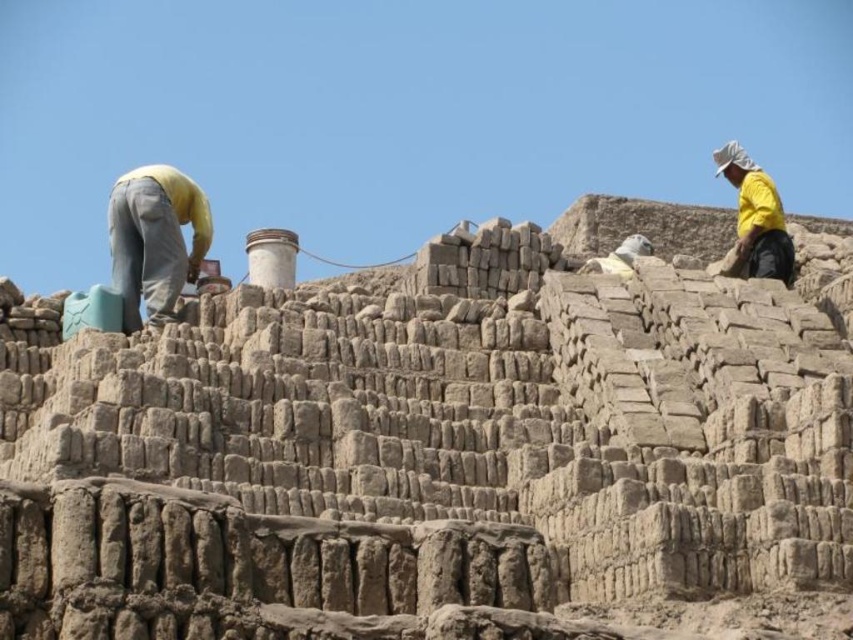
Is point (152, 193) more distant than point (770, 234)?

No, (152, 193) is closer to viewer.

Is yellow fabric at center to the left of yellow matte shirt at upper right from the viewer's perspective?

Correct, you'll find yellow fabric at center to the left of yellow matte shirt at upper right.

Does point (142, 237) lie behind point (740, 154)?

No, (142, 237) is in front of (740, 154).

The height and width of the screenshot is (640, 853). What are the coordinates of `yellow fabric at center` in the screenshot? It's located at click(154, 240).